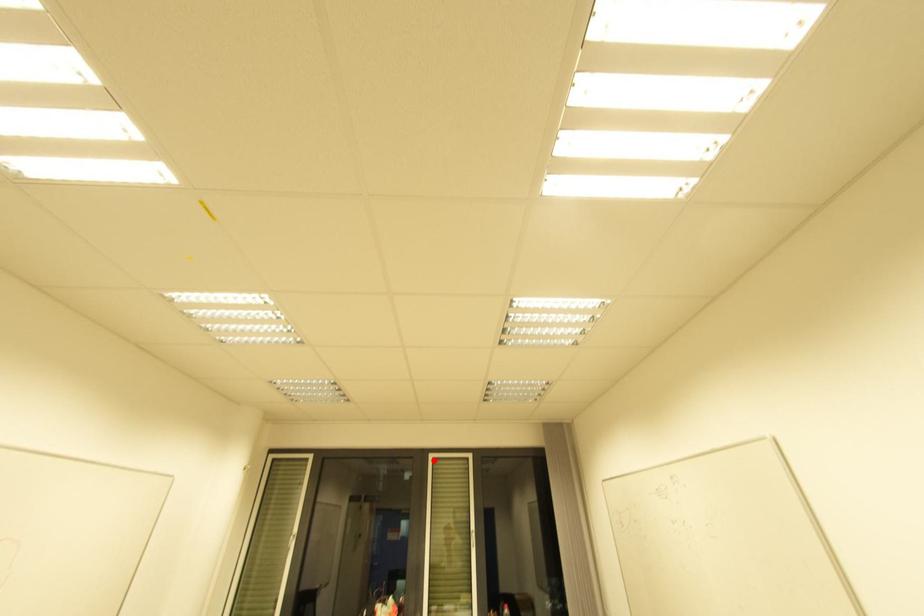
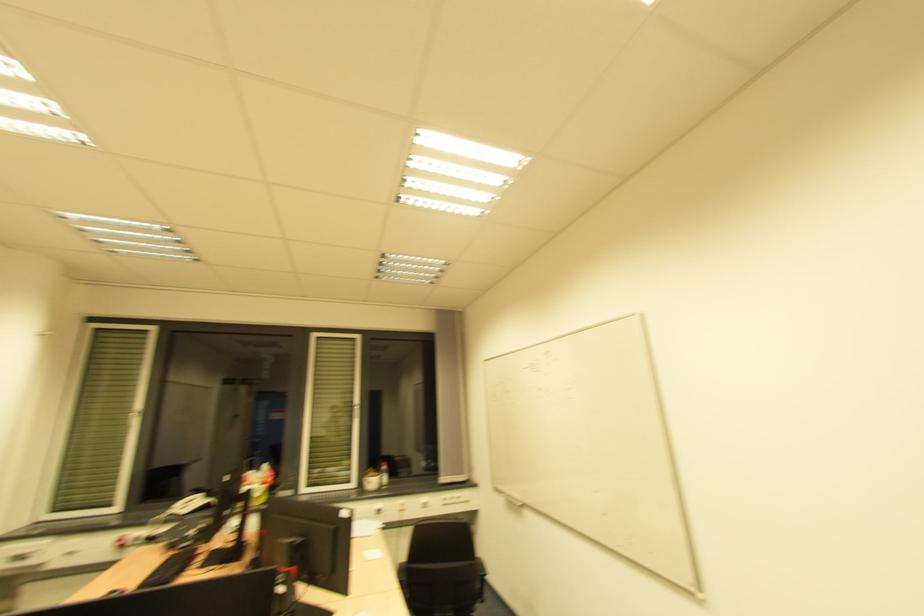
Where in the second image is the point corresponding to the highlighted location from the first image?

(320, 339)